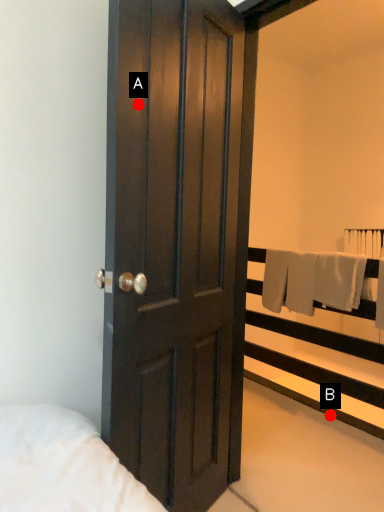
Question: Two points are circled on the image, labeled by A and B beside each circle. Which of the following is the farthest from the observer?

Choices:
 (A) A is further
 (B) B is further

Answer: (B)